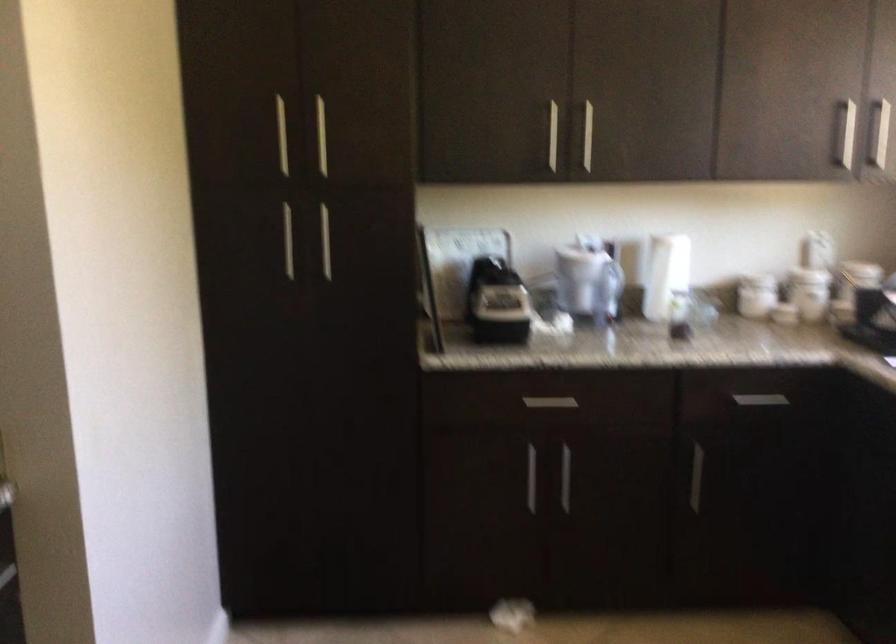
How did the camera likely rotate?

The camera rotated toward right-down.